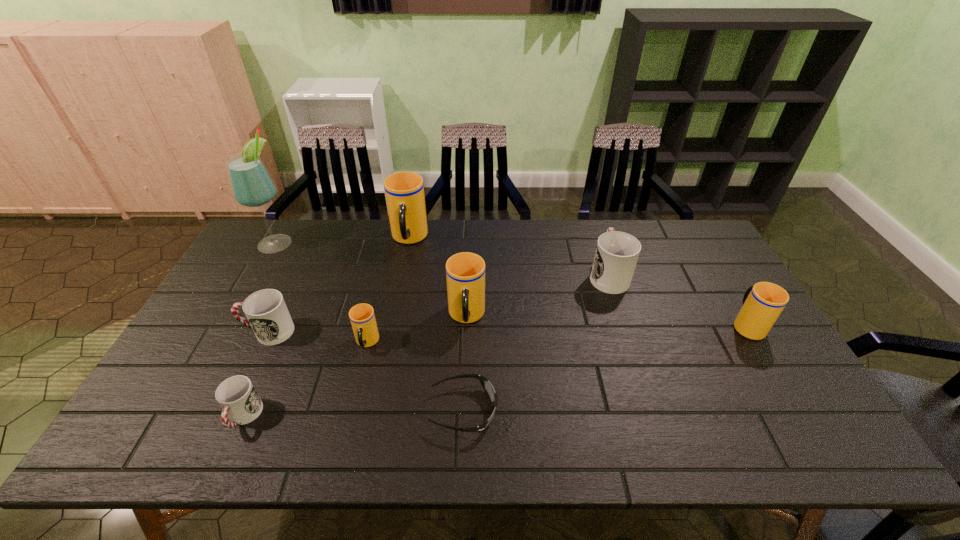
Where is `empty space that is in between the sunglasses and the second biggest red cup`? The width and height of the screenshot is (960, 540). empty space that is in between the sunglasses and the second biggest red cup is located at coordinates (366, 370).

Identify the location of free space between the farthest cup and the tallest object. The width and height of the screenshot is (960, 540). (343, 241).

The image size is (960, 540). I want to click on vacant space in between the shortest cup and the sunglasses, so click(x=353, y=413).

Image resolution: width=960 pixels, height=540 pixels. I want to click on unoccupied position between the smallest beige cup and the second beige cup from right to left, so click(417, 330).

Locate an element on the screen. The width and height of the screenshot is (960, 540). free space that is in between the rightmost red cup and the second tallest object is located at coordinates (509, 256).

This screenshot has width=960, height=540. I want to click on free space between the eighth tallest object and the smallest beige cup, so click(305, 380).

At what (x,y) coordinates should I click in order to perform the action: click on vacant area that lies between the rightmost object and the fifth cup from left to right. Please return your answer as a coordinate pair (x, y). This screenshot has width=960, height=540. Looking at the image, I should click on (607, 321).

The height and width of the screenshot is (540, 960). I want to click on free area in between the smallest beige cup and the smallest red cup, so click(305, 380).

I want to click on free space between the alcohol and the biggest red cup, so (443, 259).

I want to click on object that stands as the third closest to the nearest cup, so click(487, 386).